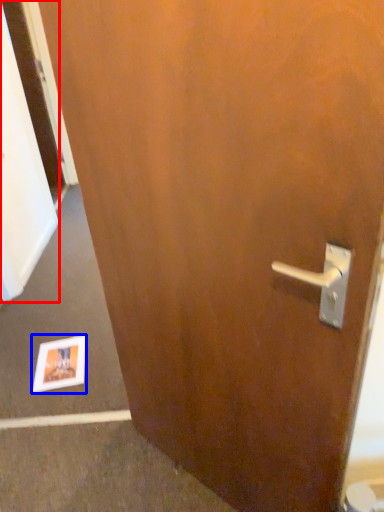
Question: Which of the following is the farthest to the observer, screen door (highlighted by a red box) or postcard (highlighted by a blue box)?

Choices:
 (A) screen door
 (B) postcard

Answer: (A)